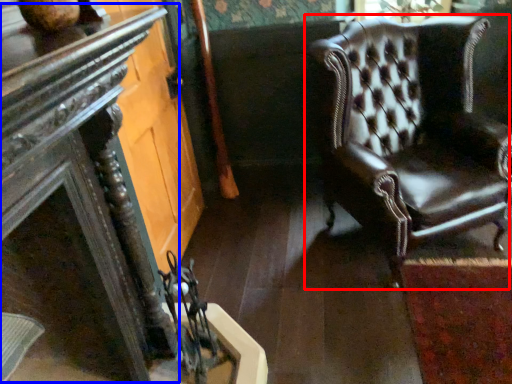
Question: Which object appears closest to the camera in this image, chair (highlighted by a red box) or table (highlighted by a blue box)?

Choices:
 (A) chair
 (B) table

Answer: (B)